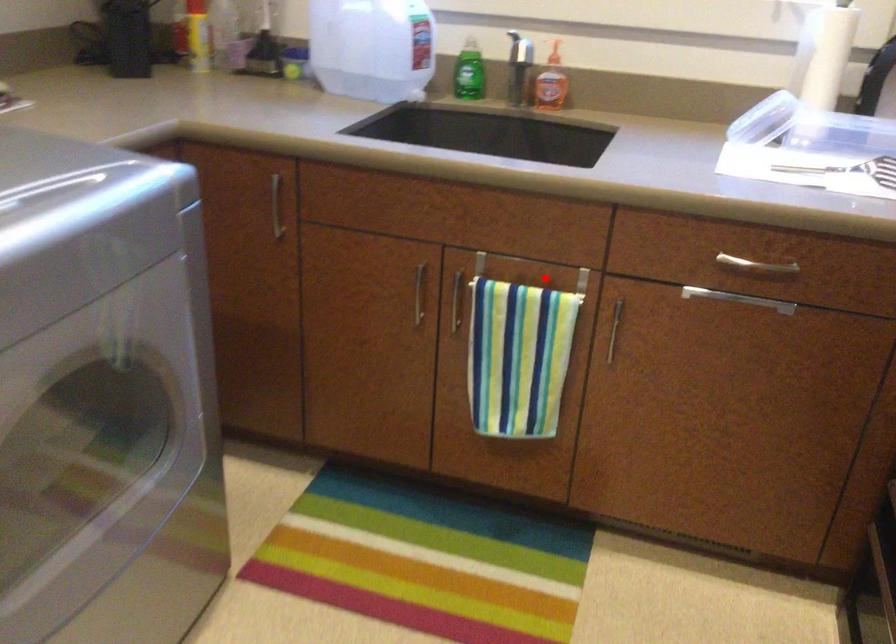
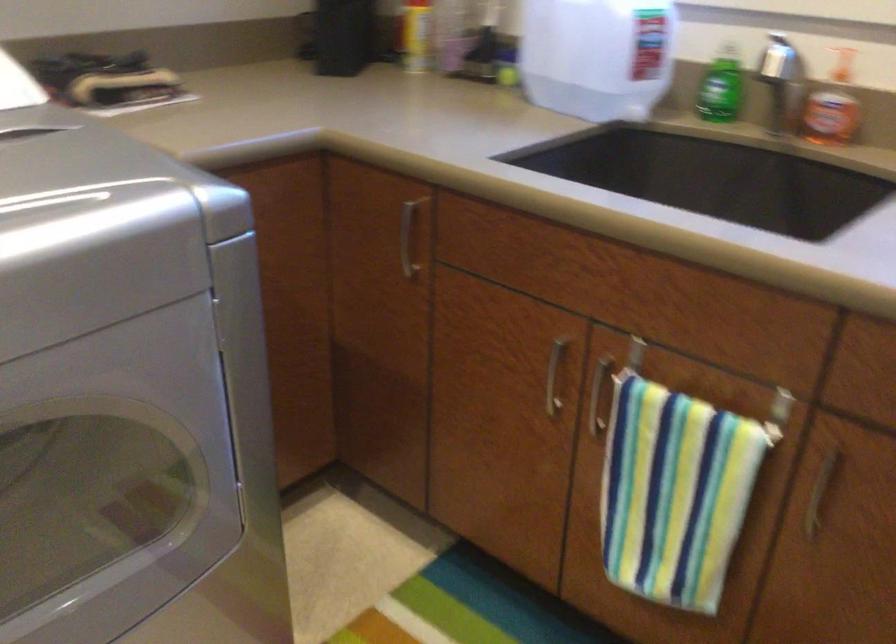
The point at the highlighted location is marked in the first image. Where is the corresponding point in the second image?

(727, 393)